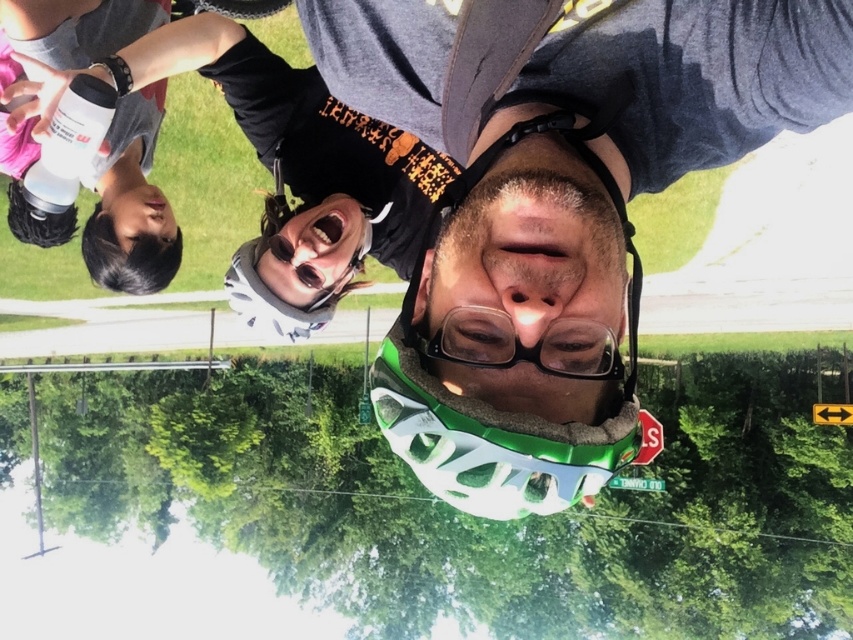
You are a photographer trying to capture a clear shot of both the white matte water bottle at upper left and the transparent plastic goggles at center. Since you can only focus on one object at a time, which object should you focus on to ensure the other is still in the frame?

You should focus on the transparent plastic goggles at center because the white matte water bottle at upper left is located above it, meaning the goggles are closer to the center of the frame and the water bottle is still within the upper part of the image.

You are a photographer trying to capture a clear shot of the white matte water bottle at upper left and the white matte bottle at upper left. Since both are white and matte, how can you distinguish them in the frame?

The white matte water bottle at upper left is larger in size than the white matte bottle at upper left, so you can tell them apart by their size difference.

You are a photographer trying to capture a clear shot of the white matte water bottle at upper left and the white matte bottle at upper left. Since they are both in the upper left corner, which one should you focus on to ensure it appears larger in your photo?

The white matte water bottle at upper left might be wider than white matte bottle at upper left, so focusing on the white matte water bottle at upper left would likely make it appear larger in the photo.